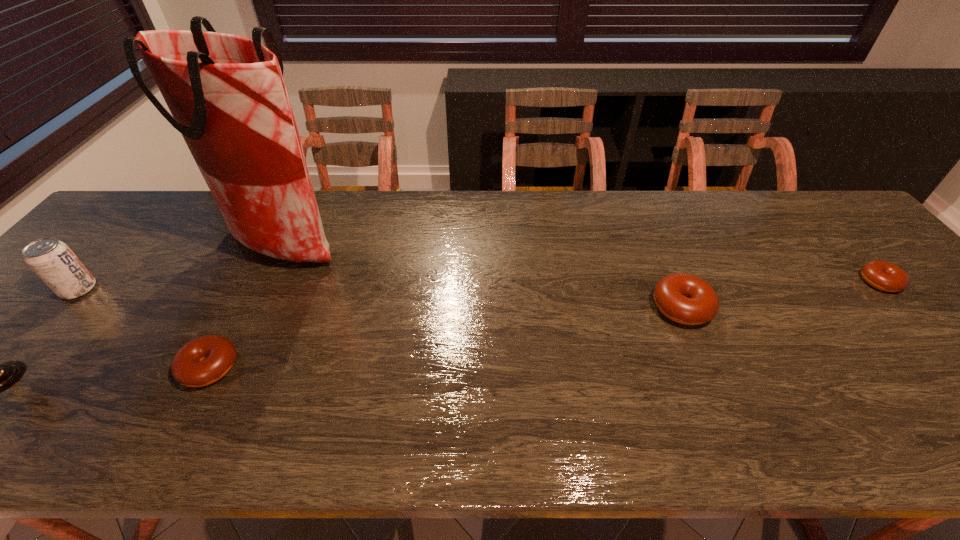
Where is `vacant region located on the left of the tallest doughnut`? This screenshot has width=960, height=540. vacant region located on the left of the tallest doughnut is located at coordinates (590, 307).

Find the location of a particular element. This screenshot has height=540, width=960. vacant space located on the front of the shortest doughnut is located at coordinates (929, 337).

This screenshot has width=960, height=540. Find the location of `vacant space located on the back of the soda can`. vacant space located on the back of the soda can is located at coordinates (117, 246).

Where is `vacant space located 0.050m on the left of the grocery bag`? The height and width of the screenshot is (540, 960). vacant space located 0.050m on the left of the grocery bag is located at coordinates (204, 248).

Identify the location of object that is at the far edge. The width and height of the screenshot is (960, 540). (226, 93).

Find the location of a particular element. This screenshot has height=540, width=960. object that is at the near edge is located at coordinates (204, 360).

At what (x,y) coordinates should I click in order to perform the action: click on object that is at the left edge. Please return your answer as a coordinate pair (x, y). The height and width of the screenshot is (540, 960). Looking at the image, I should click on (53, 261).

Identify the location of object present at the right edge. (882, 275).

What are the coordinates of `free location at the far edge of the desktop` in the screenshot? It's located at (731, 195).

This screenshot has height=540, width=960. In order to click on free point at the near edge in this screenshot , I will do `click(384, 384)`.